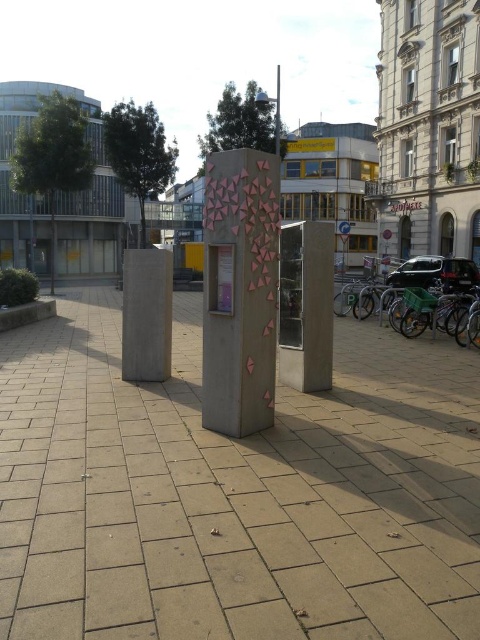
You are a city planner trying to install a new bench in the plaza. The bench requires a space that is larger than the sanded concrete pillar at center. Can the green plastic bicycle at right be used as a reference to determine if the space is large enough?

The sanded concrete pillar at center has a smaller size compared to the green plastic bicycle at right. Since the bench requires a space larger than the sanded concrete pillar at center, the green plastic bicycle at right can be used as a reference because it is larger and would indicate that the space is sufficient.